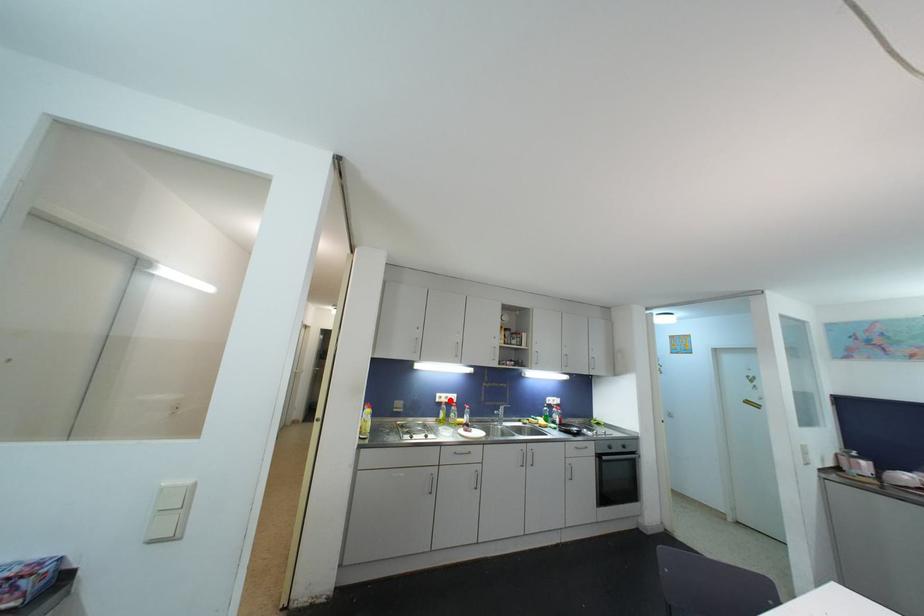
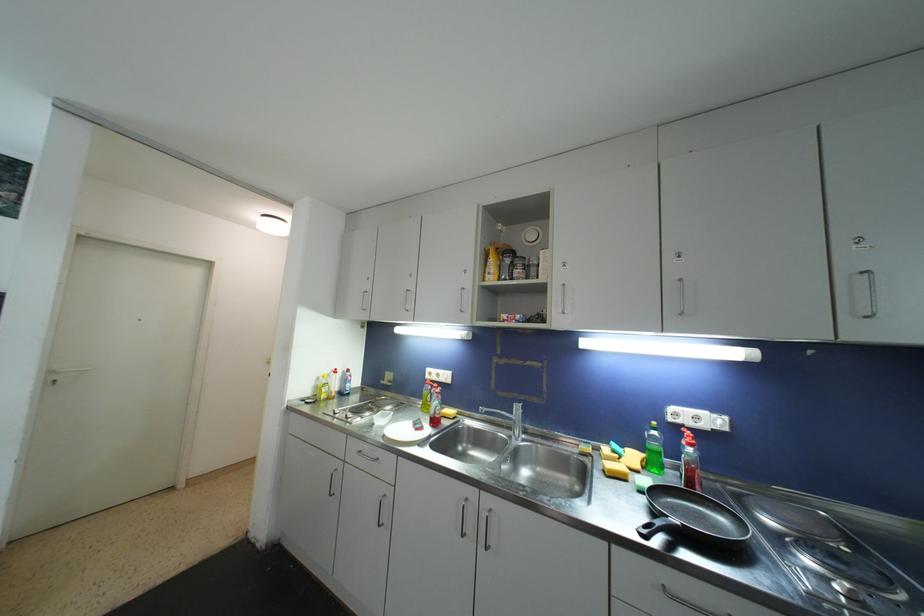
Find the pixel in the second image that matches the highlighted location in the first image.

(441, 378)